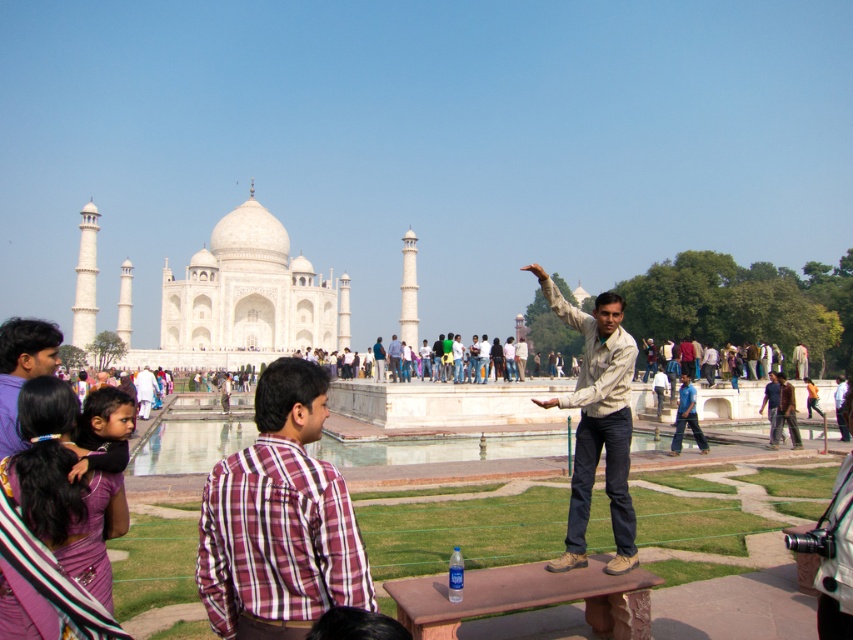
Question: Which of these objects is positioned farthest from the light brown leather jacket at center?

Choices:
 (A) plaid cotton shirt at center
 (B) light brown shirt at center
 (C) light brown cotton shirt at center
 (D) purple silk saree at lower left

Answer: (C)

Question: Which object is farther from the camera taking this photo?

Choices:
 (A) light purple shirt at lower left
 (B) light brown shirt at center
 (C) light brown leather jacket at center

Answer: (B)

Question: Observing the image, what is the correct spatial positioning of light brown leather jacket at center in reference to light purple shirt at lower left?

Choices:
 (A) below
 (B) above

Answer: (A)

Question: Which point appears farthest from the camera in this image?

Choices:
 (A) (138, 397)
 (B) (1, 330)
 (C) (392, 376)
 (D) (602, 390)

Answer: (C)

Question: Considering the relative positions of light purple shirt at lower left and light brown cotton shirt at center in the image provided, where is light purple shirt at lower left located with respect to light brown cotton shirt at center?

Choices:
 (A) below
 (B) above

Answer: (B)

Question: Does light brown cotton shirt at center have a smaller size compared to light brown shirt at center?

Choices:
 (A) yes
 (B) no

Answer: (A)